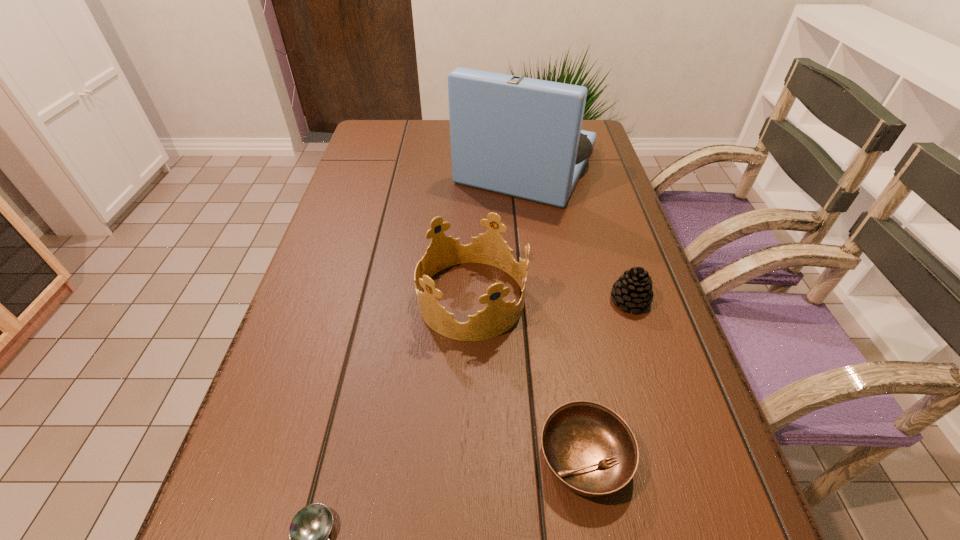
Identify the location of object positioned at the far edge. The height and width of the screenshot is (540, 960). (518, 136).

This screenshot has width=960, height=540. What are the coordinates of `phonograph record that is positioned at the right edge` in the screenshot? It's located at (518, 136).

The width and height of the screenshot is (960, 540). I want to click on pinecone situated at the right edge, so click(633, 289).

Where is `soup bowl present at the right edge`? Image resolution: width=960 pixels, height=540 pixels. soup bowl present at the right edge is located at coordinates (590, 449).

Image resolution: width=960 pixels, height=540 pixels. I want to click on object at the far right corner, so click(x=518, y=136).

Find the location of a particular element. free region at the far edge is located at coordinates (449, 150).

You are a GUI agent. You are given a task and a screenshot of the screen. Output one action in this format:
    pyautogui.click(x=<x>, y=<y>)
    Task: Click on the free space at the left edge of the desktop
    The height and width of the screenshot is (540, 960).
    Given the screenshot: What is the action you would take?
    pyautogui.click(x=368, y=161)

Find the location of a particular element. The height and width of the screenshot is (540, 960). free location at the right edge is located at coordinates (636, 246).

The height and width of the screenshot is (540, 960). In the image, there is a desktop. Identify the location of vacant space at the far left corner. (371, 145).

Where is `free space that is in between the pinecone and the fourth shortest object`? This screenshot has height=540, width=960. free space that is in between the pinecone and the fourth shortest object is located at coordinates (550, 300).